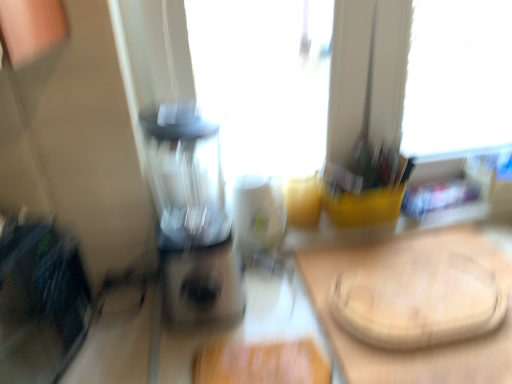
Question: Does white glossy mug at center come in front of transparent plastic blender at center?

Choices:
 (A) yes
 (B) no

Answer: (B)

Question: Could you tell me if white glossy mug at center is turned towards transparent plastic blender at center?

Choices:
 (A) no
 (B) yes

Answer: (A)

Question: Is white glossy mug at center not near transparent plastic blender at center?

Choices:
 (A) no
 (B) yes

Answer: (A)

Question: Does white glossy mug at center have a lesser height compared to transparent plastic blender at center?

Choices:
 (A) no
 (B) yes

Answer: (B)

Question: Does white glossy mug at center have a greater height compared to transparent plastic blender at center?

Choices:
 (A) yes
 (B) no

Answer: (B)

Question: Is wooden cutting board at center taller or shorter than white glossy mug at center?

Choices:
 (A) tall
 (B) short

Answer: (B)

Question: In the image, is wooden cutting board at center positioned in front of or behind white glossy mug at center?

Choices:
 (A) behind
 (B) front

Answer: (B)

Question: Looking at the image, does wooden cutting board at center seem bigger or smaller compared to white glossy mug at center?

Choices:
 (A) big
 (B) small

Answer: (A)

Question: Would you say wooden cutting board at center is inside or outside white glossy mug at center?

Choices:
 (A) outside
 (B) inside

Answer: (A)

Question: Which is correct: wooden cutting board at center is inside transparent plastic blender at center, or outside of it?

Choices:
 (A) inside
 (B) outside

Answer: (B)

Question: Relative to transparent plastic blender at center, is wooden cutting board at center in front or behind?

Choices:
 (A) behind
 (B) front

Answer: (A)

Question: Is point (401, 248) closer or farther from the camera than point (215, 147)?

Choices:
 (A) farther
 (B) closer

Answer: (B)

Question: Based on their sizes in the image, would you say wooden cutting board at center is bigger or smaller than transparent plastic blender at center?

Choices:
 (A) big
 (B) small

Answer: (B)

Question: Considering the positions of point (181, 264) and point (387, 251), is point (181, 264) closer or farther from the camera than point (387, 251)?

Choices:
 (A) farther
 (B) closer

Answer: (B)

Question: In terms of width, does transparent plastic blender at center look wider or thinner when compared to wooden cutting board at center?

Choices:
 (A) wide
 (B) thin

Answer: (B)